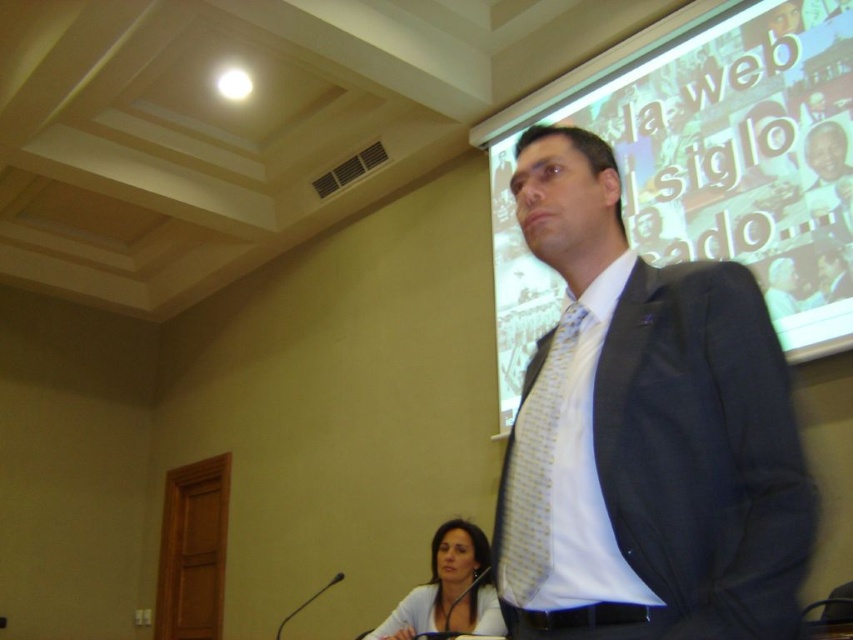
You are an event organizer setting up for a presentation. You need to ensure that the matte black suit at center worn by the presenter can fit comfortably next to the matte white projection screen at upper right on a narrow stage. Based on their sizes, will they both fit side by side if the stage has a width of 1.2 meters?

The matte black suit at center is thinner than the matte white projection screen at upper right. Since the stage is 1.2 meters wide, and the total width required would be the sum of both their widths, but since the exact widths aren not provided, we can infer that the matte black suit at center takes up less space. However, without knowing the exact dimensions, it is uncertain if they will both fit comfortably side by side.

You are organizing a formal event and need to ensure that all attire elements are appropriately sized. Given the image of a person wearing a matte black suit at center and a yellow dotted tie at center, which item has a greater width?

The matte black suit at center has a greater width than the yellow dotted tie at center.

You are organizing a presentation and need to ensure that the speaker can be seen clearly by the audience. Given the current setup with the matte black suit at center and the matte white projection screen at upper right, which object takes up more visual space in the scene?

The matte white projection screen at upper right occupies more visual space than the matte black suit at center according to the description.